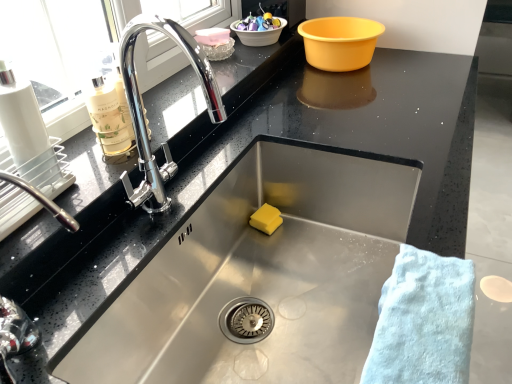
Image resolution: width=512 pixels, height=384 pixels. I want to click on free space above light blue cotton towel at lower right (from a real-world perspective), so click(424, 317).